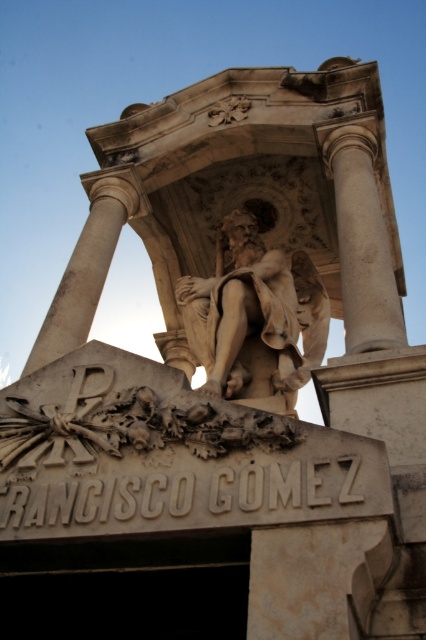
Question: Is beige stone statue at center closer to the viewer compared to white marble column at center?

Choices:
 (A) yes
 (B) no

Answer: (B)

Question: Which of the following is the closest to the observer?

Choices:
 (A) beige stone statue at center
 (B) white marble column at center

Answer: (B)

Question: Does beige stone statue at center lie behind white marble column at center?

Choices:
 (A) no
 (B) yes

Answer: (B)

Question: Is beige stone statue at center below white marble column at center?

Choices:
 (A) no
 (B) yes

Answer: (B)